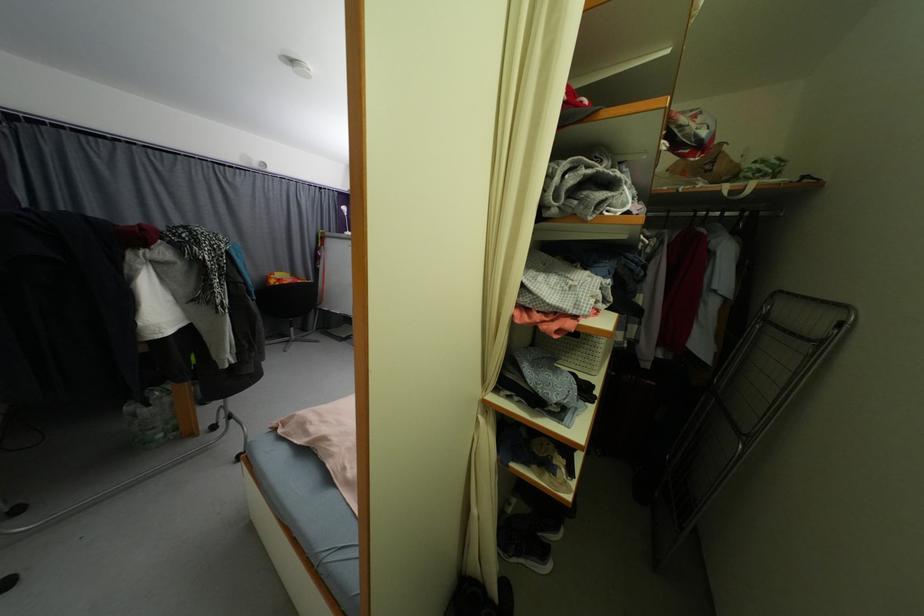
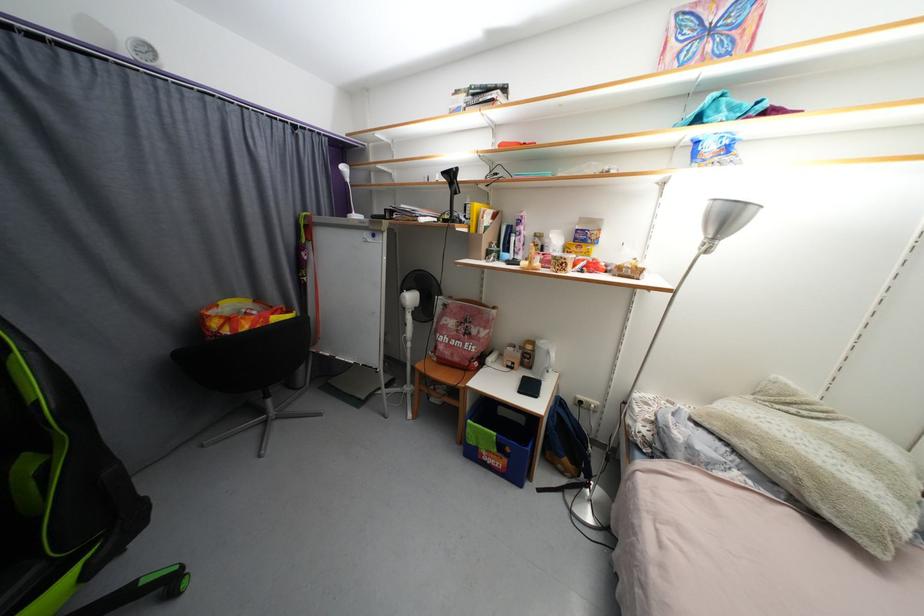
Find the pixel in the second image that matches (x=354, y=235) in the first image.

(360, 217)